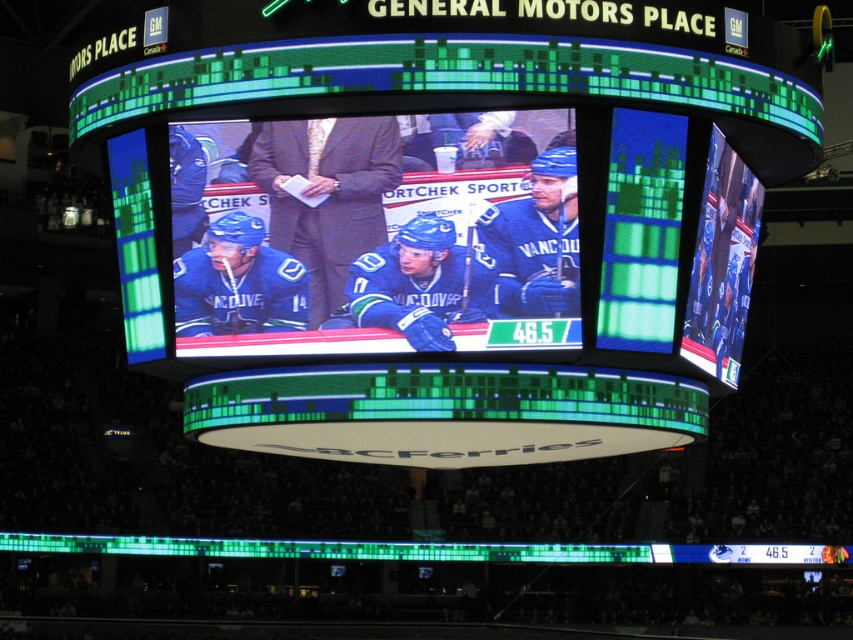
You are an event planner trying to set up a photo shoot in the arena. You want to capture both the matte black scoreboard at center and the blue jersey hockey players at center in the same frame. Based on their sizes, which object will occupy more space in the photo?

The matte black scoreboard at center has a greater width than the blue jersey hockey players at center, so it will occupy more space in the photo.

You are attending a hockey game at General Motors Place and notice the matte black scoreboard at center and the blue jersey hockey players at center. From your seat, which object appears closer to you?

The blue jersey hockey players at center appear closer because the matte black scoreboard at center is positioned under them, indicating they are in front.